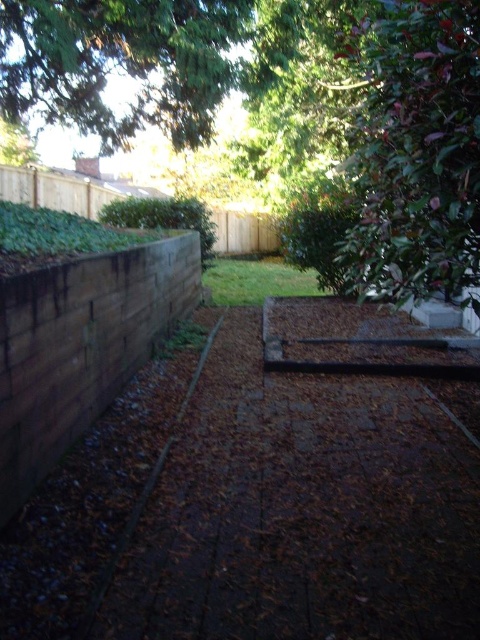
Is green leafy tree at upper right bigger than green leafy tree at upper center?

Yes.

Who is positioned more to the left, green leafy tree at upper right or green leafy tree at upper center?

Positioned to the left is green leafy tree at upper center.

The height and width of the screenshot is (640, 480). In order to click on green leafy tree at upper right in this screenshot , I will do `click(417, 150)`.

Which is more to the left, green leafy tree at upper center or brown wood fence at upper center?

brown wood fence at upper center is more to the left.

Measure the distance between green leafy tree at upper center and camera.

48.10 feet

Is point (191, 52) closer to camera compared to point (274, 244)?

That is True.

This screenshot has width=480, height=640. I want to click on green leafy tree at upper center, so click(120, 64).

Does green leafy tree at upper right have a lesser width compared to brown wood fence at upper center?

Yes, green leafy tree at upper right is thinner than brown wood fence at upper center.

What do you see at coordinates (417, 150) in the screenshot? I see `green leafy tree at upper right` at bounding box center [417, 150].

Locate an element on the screen. green leafy tree at upper right is located at coordinates (417, 150).